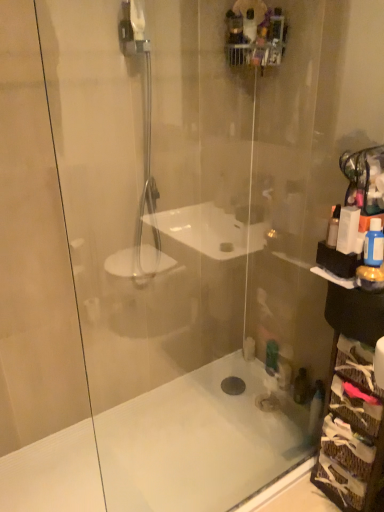
Question: Is white plastic bottle at right, the first toiletry when ordered from left to right, spatially inside white matte bathtub at lower center, or outside of it?

Choices:
 (A) inside
 (B) outside

Answer: (B)

Question: Relative to white matte bathtub at lower center, is white plastic bottle at right, the 3th toiletry in the right-to-left sequence, in front or behind?

Choices:
 (A) front
 (B) behind

Answer: (B)

Question: Which of these objects is positioned closest to the white plastic bottle at right, the 3th toiletry in the right-to-left sequence?

Choices:
 (A) woven basket at right
 (B) white matte bathtub at lower center
 (C) white plastic box at right, which is the 2th toiletry from right to left
 (D) blue glossy bottle at right, the third toiletry in the left-to-right sequence

Answer: (C)

Question: Which is farther from the blue glossy bottle at right, the third toiletry in the left-to-right sequence?

Choices:
 (A) white matte bathtub at lower center
 (B) woven basket at right
 (C) white plastic bottle at right, the first toiletry when ordered from left to right
 (D) white plastic box at right, the 2th toiletry when ordered from left to right

Answer: (A)